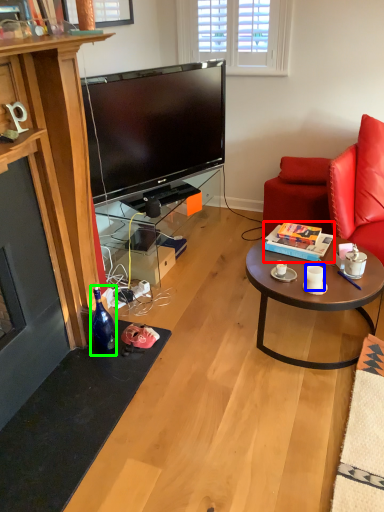
Question: Based on their relative distances, which object is farther from box (highlighted by a red box)? Choose from coffee cup (highlighted by a blue box) and bottle (highlighted by a green box).

Choices:
 (A) coffee cup
 (B) bottle

Answer: (B)